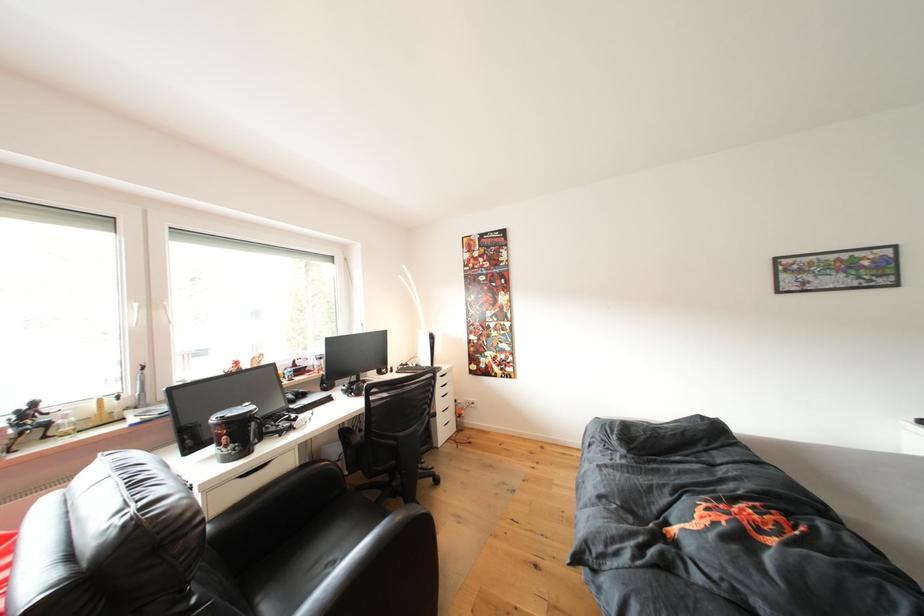
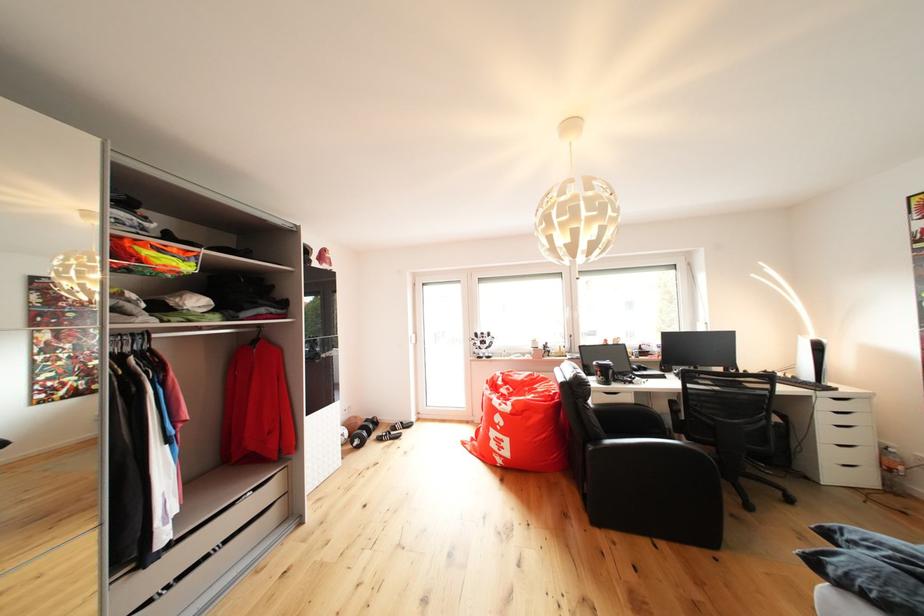
Find the pixel in the second image that matches the point at 454,371 in the first image.

(855, 395)